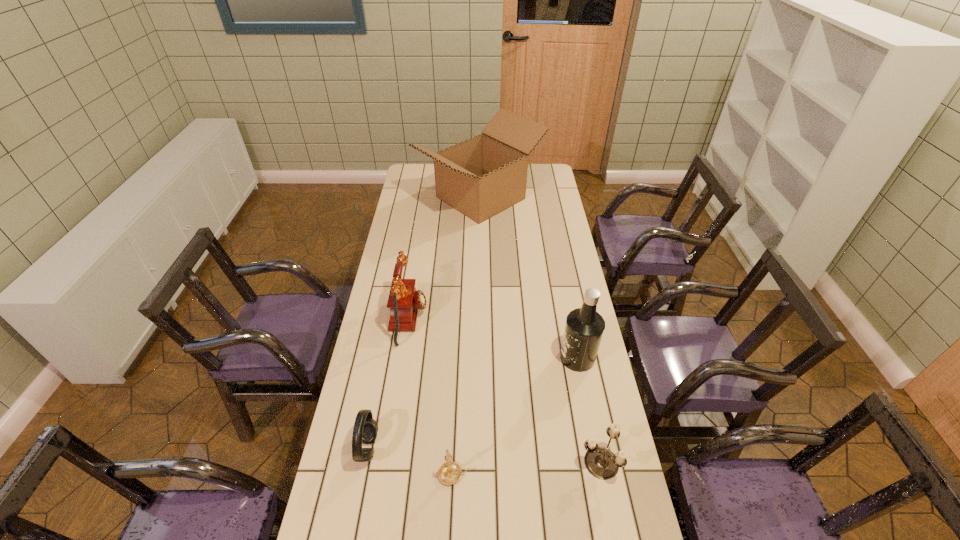
Where is `candle holder located at the right edge`? This screenshot has width=960, height=540. candle holder located at the right edge is located at coordinates (602, 463).

Find the location of a particular element. Image resolution: width=960 pixels, height=540 pixels. object positioned at the far left corner is located at coordinates (480, 177).

You are a GUI agent. You are given a task and a screenshot of the screen. Output one action in this format:
    pyautogui.click(x=<x>, y=<y>)
    Task: Click on the object that is positioned at the far right corner
    
    Given the screenshot: What is the action you would take?
    [x=480, y=177]

Where is `free space at the left edge of the desktop`? The height and width of the screenshot is (540, 960). free space at the left edge of the desktop is located at coordinates (400, 332).

Locate an element on the screen. The image size is (960, 540). vacant region at the right edge of the desktop is located at coordinates (553, 259).

Identify the location of free point between the farthest object and the headset. (424, 323).

Find the location of a particular element. This screenshot has height=540, width=960. vacant area between the telephone and the right candle holder is located at coordinates (504, 391).

This screenshot has height=540, width=960. I want to click on unoccupied position between the liquor and the right candle holder, so click(588, 410).

Image resolution: width=960 pixels, height=540 pixels. I want to click on blank region between the liquor and the left candle holder, so click(x=516, y=416).

Locate an element on the screen. The image size is (960, 540). vacant point located between the headset and the liquor is located at coordinates (472, 403).